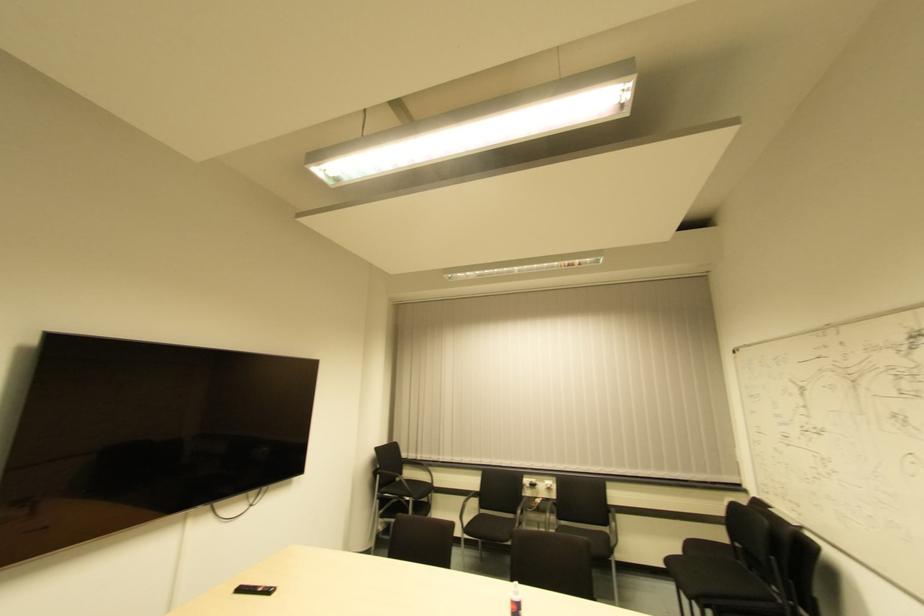
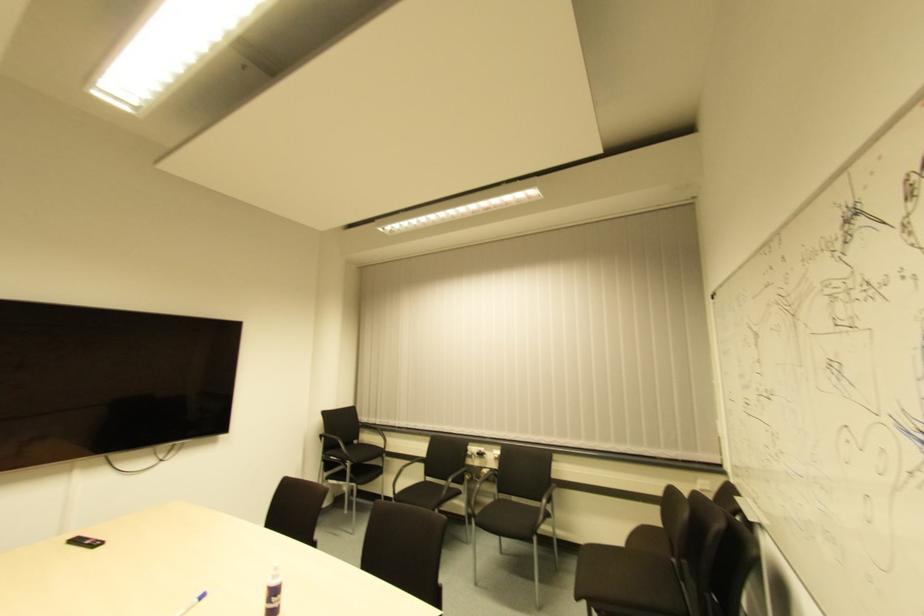
In the second image, find the point that corresponds to [546,492] in the first image.

(494, 462)